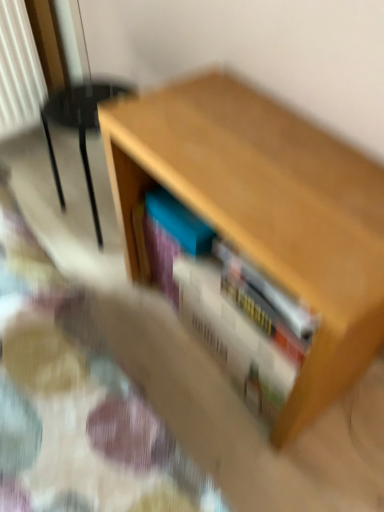
Question: Should I look upward or downward to see blue matte book at center?

Choices:
 (A) up
 (B) down

Answer: (A)

Question: Considering the relative sizes of blue matte book at center and velvet beige armchair at left in the image provided, is blue matte book at center wider than velvet beige armchair at left?

Choices:
 (A) yes
 (B) no

Answer: (B)

Question: Can you confirm if blue matte book at center is thinner than velvet beige armchair at left?

Choices:
 (A) no
 (B) yes

Answer: (B)

Question: From the image's perspective, does blue matte book at center appear higher than velvet beige armchair at left?

Choices:
 (A) yes
 (B) no

Answer: (B)

Question: Considering the relative positions of blue matte book at center and velvet beige armchair at left in the image provided, is blue matte book at center behind velvet beige armchair at left?

Choices:
 (A) no
 (B) yes

Answer: (A)

Question: Does blue matte book at center have a lesser height compared to velvet beige armchair at left?

Choices:
 (A) yes
 (B) no

Answer: (A)

Question: From a real-world perspective, is blue matte book at center positioned over velvet beige armchair at left based on gravity?

Choices:
 (A) no
 (B) yes

Answer: (B)

Question: Is velvet beige armchair at left to the left of white matte book at center from the viewer's perspective?

Choices:
 (A) no
 (B) yes

Answer: (B)

Question: Is velvet beige armchair at left positioned in front of white matte book at center?

Choices:
 (A) yes
 (B) no

Answer: (B)

Question: From the image's perspective, would you say velvet beige armchair at left is shown under white matte book at center?

Choices:
 (A) no
 (B) yes

Answer: (A)

Question: From a real-world perspective, is velvet beige armchair at left located higher than white matte book at center?

Choices:
 (A) no
 (B) yes

Answer: (B)

Question: Does velvet beige armchair at left have a greater height compared to white matte book at center?

Choices:
 (A) no
 (B) yes

Answer: (B)

Question: Is velvet beige armchair at left oriented away from white matte book at center?

Choices:
 (A) no
 (B) yes

Answer: (A)

Question: Is white matte book at center not within wooden table at center?

Choices:
 (A) yes
 (B) no

Answer: (B)